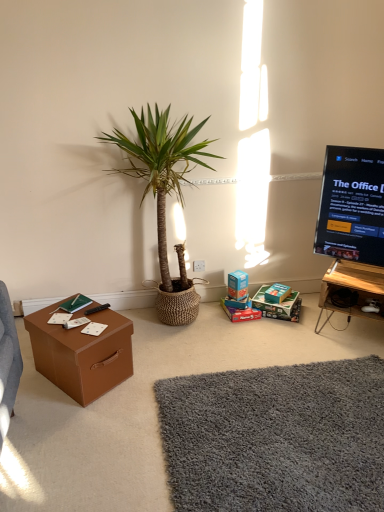
Question: Relative to black glossy screen at upper right, is white plastic power outlet at center in front or behind?

Choices:
 (A) front
 (B) behind

Answer: (B)

Question: Considering the positions of point (198, 270) and point (347, 168), is point (198, 270) closer or farther from the camera than point (347, 168)?

Choices:
 (A) closer
 (B) farther

Answer: (B)

Question: Considering the real-world distances, which object is farthest from the wooden entertainment center at right?

Choices:
 (A) black glossy screen at upper right
 (B) shaggy gray rug at lower center, placed as the 2th plain when sorted from front to back
 (C) green woven pot at center
 (D) black plastic remote control at lower left
 (E) teal cardboard box at center, marked as the 2th storage box in a right-to-left arrangement

Answer: (D)

Question: Estimate the real-world distances between objects in this image. Which object is farther from the wooden entertainment center at right?

Choices:
 (A) green woven pot at center
 (B) matte brown cardboard box at center
 (C) matte brown storage box at lower right, marked as the 1th storage box in a right-to-left arrangement
 (D) white plastic power outlet at center
 (E) black plastic remote control at lower left

Answer: (E)